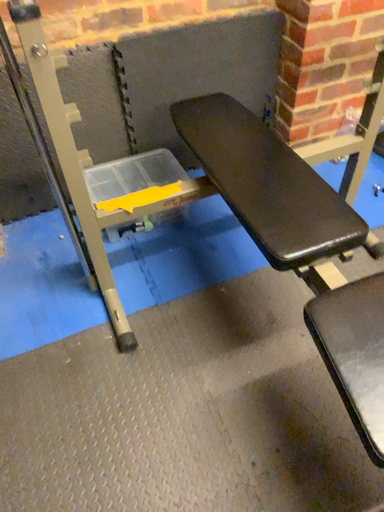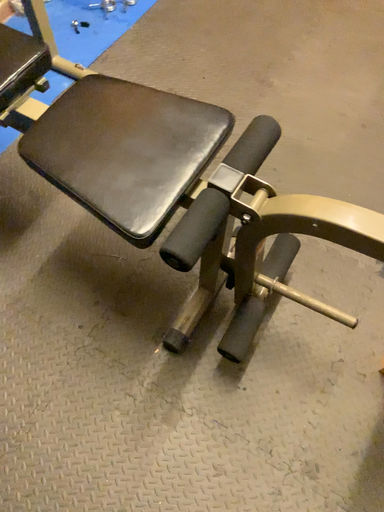
Question: Which way did the camera rotate in the video?

Choices:
 (A) rotated right
 (B) rotated left

Answer: (A)